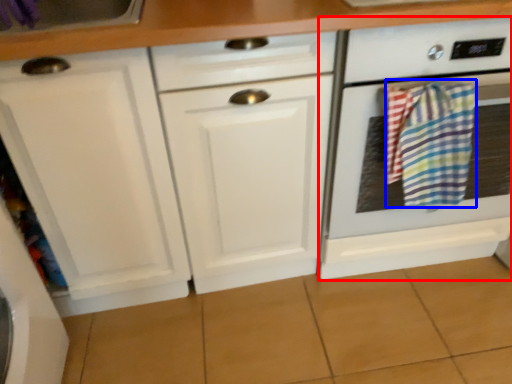
Question: Which of the following is the closest to the observer, home appliance (highlighted by a red box) or beach towel (highlighted by a blue box)?

Choices:
 (A) home appliance
 (B) beach towel

Answer: (A)